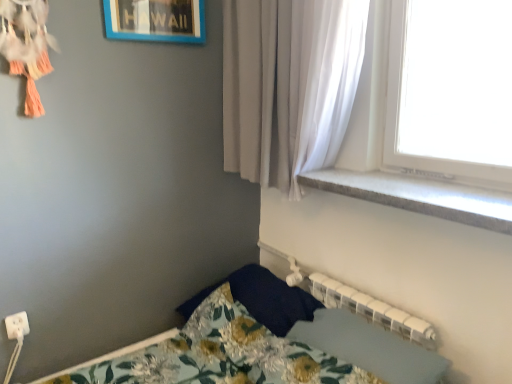
Image resolution: width=512 pixels, height=384 pixels. In order to click on dark blue fabric pillow at lower center in this screenshot , I will do `click(262, 299)`.

The image size is (512, 384). Identify the location of floral fabric bedsheet at lower center. 370,347.

Where is `blue plastic picture frame at upper center`? The height and width of the screenshot is (384, 512). blue plastic picture frame at upper center is located at coordinates (155, 20).

The width and height of the screenshot is (512, 384). What do you see at coordinates (230, 334) in the screenshot?
I see `floral fabric bed at lower left` at bounding box center [230, 334].

What do you see at coordinates (419, 196) in the screenshot? The height and width of the screenshot is (384, 512). I see `gray concrete window sill at upper right` at bounding box center [419, 196].

Find the location of `dark blue fabric pillow at lower center`. dark blue fabric pillow at lower center is located at coordinates (262, 299).

Does point (212, 335) come closer to viewer compared to point (358, 323)?

No, (212, 335) is further to viewer.

The width and height of the screenshot is (512, 384). Find the location of `bed on the left of the floral fabric bedsheet at lower center`. bed on the left of the floral fabric bedsheet at lower center is located at coordinates (230, 334).

Does floral fabric bed at lower left have a larger size compared to floral fabric bedsheet at lower center?

Indeed, floral fabric bed at lower left has a larger size compared to floral fabric bedsheet at lower center.

Which object is positioned more to the right, floral fabric bed at lower left or floral fabric bedsheet at lower center?

floral fabric bedsheet at lower center.

From their relative heights in the image, would you say blue plastic picture frame at upper center is taller or shorter than white sheer curtain at upper right?

In the image, blue plastic picture frame at upper center appears to be shorter than white sheer curtain at upper right.

Considering the sizes of objects blue plastic picture frame at upper center and white sheer curtain at upper right in the image provided, who is thinner, blue plastic picture frame at upper center or white sheer curtain at upper right?

blue plastic picture frame at upper center.

Identify the location of picture frame on the left of white sheer curtain at upper right. Image resolution: width=512 pixels, height=384 pixels. click(x=155, y=20).

Is blue plastic picture frame at upper center spatially inside white sheer curtain at upper right, or outside of it?

blue plastic picture frame at upper center is spatially situated outside white sheer curtain at upper right.

Is white sheer curtain at upper right in contact with white plastic electric outlet at lower left?

No, white sheer curtain at upper right is not making contact with white plastic electric outlet at lower left.

Could white plastic electric outlet at lower left be considered to be inside white sheer curtain at upper right?

No, white plastic electric outlet at lower left is located outside of white sheer curtain at upper right.

Which is behind, point (241, 14) or point (8, 319)?

The point (241, 14) is behind.

Identify the location of electric outlet directly beneath the gray concrete window sill at upper right (from a real-world perspective). This screenshot has height=384, width=512. (17, 325).

In the scene shown: Is the depth of gray concrete window sill at upper right less than that of white plastic electric outlet at lower left?

Yes, gray concrete window sill at upper right is closer to the viewer.

Can white plastic electric outlet at lower left be found inside gray concrete window sill at upper right?

No, white plastic electric outlet at lower left is not surrounded by gray concrete window sill at upper right.

Can you confirm if gray concrete window sill at upper right is smaller than white plastic electric outlet at lower left?

Incorrect, gray concrete window sill at upper right is not smaller in size than white plastic electric outlet at lower left.

Is point (292, 324) positioned in front of point (156, 20)?

No, (292, 324) is behind (156, 20).

Is dark blue fabric pillow at lower center turned away from blue plastic picture frame at upper center?

No, dark blue fabric pillow at lower center's orientation is not away from blue plastic picture frame at upper center.

Is dark blue fabric pillow at lower center positioned before blue plastic picture frame at upper center?

Yes, it is.

The image size is (512, 384). In the image, there is a blue plastic picture frame at upper center. What are the coordinates of `pillow below it (from the image's perspective)` in the screenshot? It's located at (262, 299).

Is white sheer curtain at upper right far from floral fabric bed at lower left?

No, white sheer curtain at upper right is not far from floral fabric bed at lower left.

Is white sheer curtain at upper right oriented away from floral fabric bed at lower left?

No, white sheer curtain at upper right is not facing the opposite direction of floral fabric bed at lower left.

From the picture: From a real-world perspective, is white sheer curtain at upper right located beneath floral fabric bed at lower left?

No, from a real-world perspective, white sheer curtain at upper right is not below floral fabric bed at lower left.

Is white sheer curtain at upper right to the right of floral fabric bed at lower left from the viewer's perspective?

Yes.

Is floral fabric bedsheet at lower center in front of or behind floral fabric bed at lower left in the image?

In the image, floral fabric bedsheet at lower center appears behind floral fabric bed at lower left.

Can you tell me how much floral fabric bedsheet at lower center and floral fabric bed at lower left differ in facing direction?

The angle between the facing direction of floral fabric bedsheet at lower center and the facing direction of floral fabric bed at lower left is 1.57 degrees.

From a real-world perspective, which object stands above the other?

floral fabric bedsheet at lower center, from a real-world perspective.

Is floral fabric bedsheet at lower center taller than floral fabric bed at lower left?

In fact, floral fabric bedsheet at lower center may be shorter than floral fabric bed at lower left.

Where is `sheet behind the floral fabric bed at lower left`? sheet behind the floral fabric bed at lower left is located at coordinates (370, 347).

You are a GUI agent. You are given a task and a screenshot of the screen. Output one action in this format:
    pyautogui.click(x=<x>, y=<y>)
    Task: Click on the picture frame above the white sheer curtain at upper right (from the image's perspective)
    Image resolution: width=512 pixels, height=384 pixels.
    Given the screenshot: What is the action you would take?
    pyautogui.click(x=155, y=20)

When comparing their distances from floral fabric bedsheet at lower center, does floral fabric bed at lower left or dark blue fabric pillow at lower center seem further?

dark blue fabric pillow at lower center is further to floral fabric bedsheet at lower center.

Looking at the image, which one is located closer to floral fabric bed at lower left, white sheer curtain at upper right or floral fabric bedsheet at lower center?

The object closer to floral fabric bed at lower left is floral fabric bedsheet at lower center.

Based on their spatial positions, is gray concrete window sill at upper right or white sheer curtain at upper right closer to dark blue fabric pillow at lower center?

Among the two, gray concrete window sill at upper right is located nearer to dark blue fabric pillow at lower center.

From the picture: Based on their spatial positions, is white plastic electric outlet at lower left or dark blue fabric pillow at lower center closer to floral fabric bedsheet at lower center?

Based on the image, dark blue fabric pillow at lower center appears to be nearer to floral fabric bedsheet at lower center.

Estimate the real-world distances between objects in this image. Which object is further from floral fabric bedsheet at lower center, floral fabric bed at lower left or white plastic electric outlet at lower left?

white plastic electric outlet at lower left is positioned further to the anchor floral fabric bedsheet at lower center.

Which object lies nearer to the anchor point floral fabric bed at lower left, floral fabric bedsheet at lower center or gray concrete window sill at upper right?

The object closer to floral fabric bed at lower left is floral fabric bedsheet at lower center.

Based on their spatial positions, is gray concrete window sill at upper right or dark blue fabric pillow at lower center closer to white sheer curtain at upper right?

Based on the image, gray concrete window sill at upper right appears to be nearer to white sheer curtain at upper right.

Looking at the image, which one is located further to white plastic electric outlet at lower left, white sheer curtain at upper right or floral fabric bedsheet at lower center?

white sheer curtain at upper right is further to white plastic electric outlet at lower left.

Where is `sheet between white sheer curtain at upper right and floral fabric bed at lower left from top to bottom`? sheet between white sheer curtain at upper right and floral fabric bed at lower left from top to bottom is located at coordinates (370, 347).

Find the location of a particular element. pillow between white sheer curtain at upper right and floral fabric bedsheet at lower center from top to bottom is located at coordinates (262, 299).

What are the coordinates of `window sill located between floral fabric bed at lower left and dark blue fabric pillow at lower center in the depth direction` in the screenshot? It's located at (419, 196).

This screenshot has width=512, height=384. In order to click on electric outlet that lies between blue plastic picture frame at upper center and floral fabric bedsheet at lower center from top to bottom in this screenshot , I will do `click(17, 325)`.